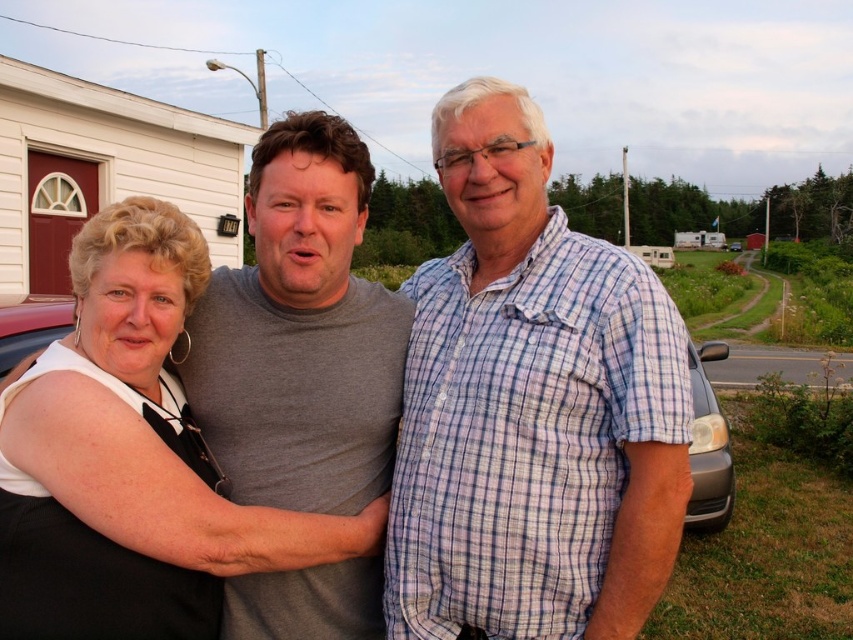
You are a photographer trying to capture a candid shot of the plaid cotton shirt at center and the matte black dress at center. Which one should you focus on first to ensure it is in the foreground of your photo?

The plaid cotton shirt at center is further to the viewer than the matte black dress at center, so you should focus on the plaid cotton shirt at center first to ensure it is in the foreground.

Based on the scene description, which object is bigger between the matte gray shirt at center and the matte black dress at center?

The matte gray shirt at center is larger than the matte black dress at center according to the description.

You are standing 5 feet away from the camera. You want to toss a ball to the matte gray shirt at center without it going past them. Is this possible?

The matte gray shirt at center is 6.06 feet away from the camera. Since you are only 5 feet away from the camera, you are closer to the camera than the matte gray shirt at center. Tossing the ball to them without it going past would require throwing it forward 1.06 feet from your current position.